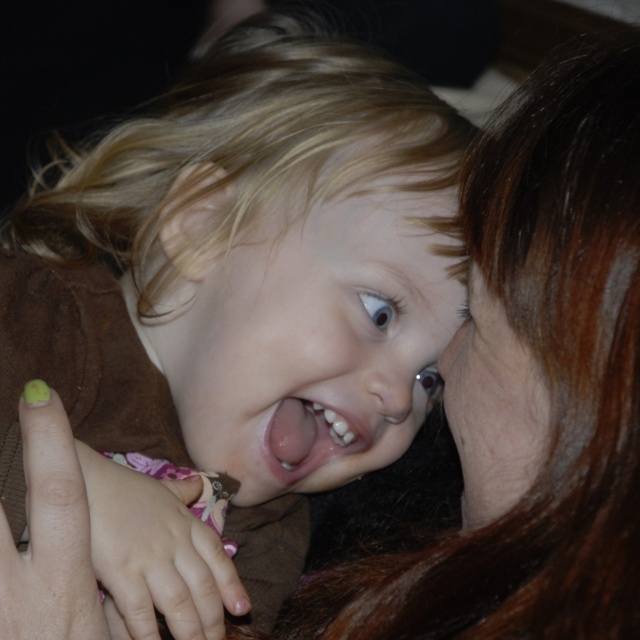
Question: Among these objects, which one is nearest to the camera?

Choices:
 (A) smooth skin face at center
 (B) pink flesh-colored tongue at center
 (C) blonde hair at center

Answer: (C)

Question: Does blonde hair at center come in front of smooth skin face at center?

Choices:
 (A) yes
 (B) no

Answer: (A)

Question: Can you confirm if blonde hair at center is wider than smooth skin face at center?

Choices:
 (A) no
 (B) yes

Answer: (B)

Question: Is smooth skin face at center in front of pink flesh-colored tongue at center?

Choices:
 (A) no
 (B) yes

Answer: (B)

Question: Among these points, which one is nearest to the camera?

Choices:
 (A) (360, 76)
 (B) (340, 472)

Answer: (B)

Question: Which object is closer to the camera taking this photo?

Choices:
 (A) blonde hair at center
 (B) pink flesh-colored tongue at center
 (C) smooth skin face at center

Answer: (A)